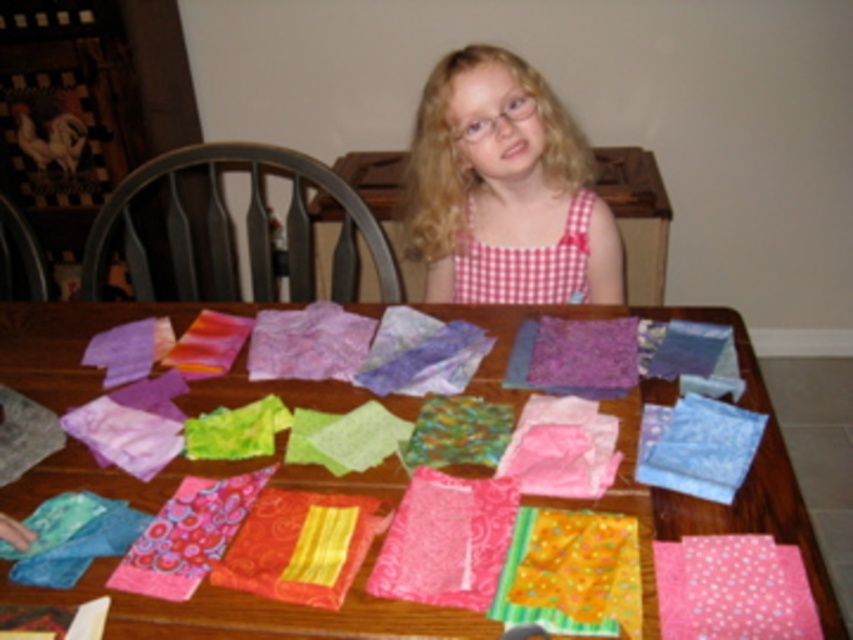
Question: Is wooden table at center further to the viewer compared to pink polka dot fabric at lower right?

Choices:
 (A) yes
 (B) no

Answer: (A)

Question: Which is nearer to the pink checkered dress at center?

Choices:
 (A) wooden table at center
 (B) yellow textured fabric at center
 (C) red checkered fabric at upper center

Answer: (C)

Question: Is yellow textured fabric at center bigger than pink satin fabric at center?

Choices:
 (A) no
 (B) yes

Answer: (A)

Question: Among these points, which one is nearest to the camera?

Choices:
 (A) (538, 273)
 (B) (381, 632)

Answer: (B)

Question: Is pink satin fabric at center bigger than blue satin fabric at center?

Choices:
 (A) no
 (B) yes

Answer: (B)

Question: Which point is closer to the camera?

Choices:
 (A) (486, 291)
 (B) (752, 572)

Answer: (B)